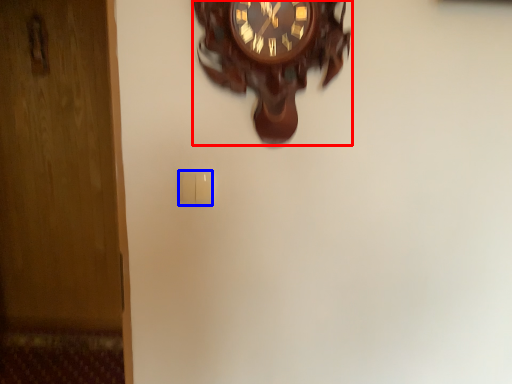
Question: Which of the following is the closest to the observer, wall clock (highlighted by a red box) or light switch (highlighted by a blue box)?

Choices:
 (A) wall clock
 (B) light switch

Answer: (A)